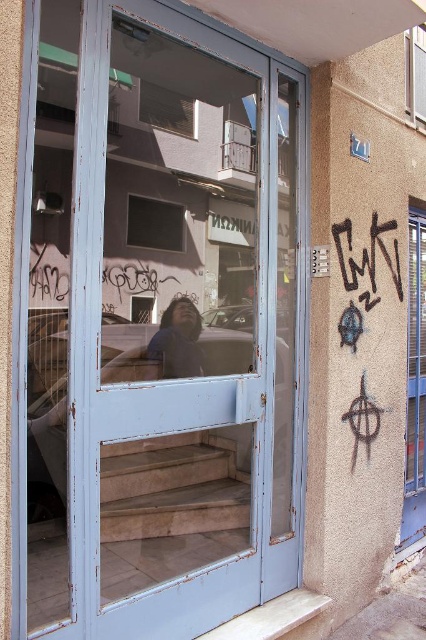
Question: Can you confirm if dark brown hair at center is positioned to the left of matte glass window at center?

Choices:
 (A) no
 (B) yes

Answer: (A)

Question: Which point appears closest to the camera in this image?

Choices:
 (A) tap(146, 93)
 (B) tap(150, 198)
 (C) tap(405, 80)
 (D) tap(169, 305)

Answer: (A)

Question: Which of these objects is positioned farthest from the matte glass window at center?

Choices:
 (A) clear glass window at upper right
 (B) clear glass window at upper center
 (C) clear glass window at right
 (D) dark brown hair at center

Answer: (A)

Question: Does black graffiti at upper right appear on the left side of clear glass window at upper center?

Choices:
 (A) yes
 (B) no

Answer: (B)

Question: Considering the relative positions of clear glass window at right and dark brown hair at center in the image provided, where is clear glass window at right located with respect to dark brown hair at center?

Choices:
 (A) above
 (B) below

Answer: (B)

Question: Based on their relative distances, which object is nearer to the matte glass window at center?

Choices:
 (A) clear glass window at upper right
 (B) clear glass window at upper center
 (C) black graffiti at upper right
 (D) dark brown hair at center

Answer: (B)